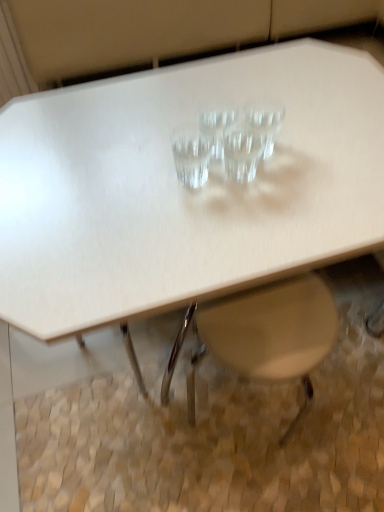
At what (x,y) coordinates should I click in order to perform the action: click on vacant region to the left of transparent glass martini glass at center, acting as the 1th martini glass starting from the right. Please return your answer as a coordinate pair (x, y). Looking at the image, I should click on (167, 151).